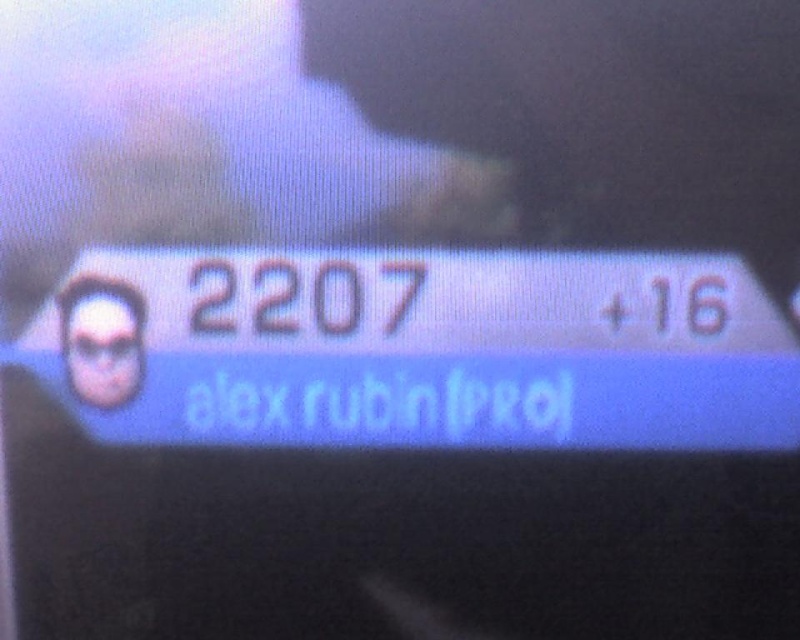
Question: Can you confirm if blue glossy text at center is bigger than matte black sunglasses at left?

Choices:
 (A) no
 (B) yes

Answer: (B)

Question: Which of the following is the closest to the observer?

Choices:
 (A) matte black sunglasses at left
 (B) blue glossy text at center

Answer: (B)

Question: Can you confirm if blue glossy text at center is positioned to the right of matte black sunglasses at left?

Choices:
 (A) yes
 (B) no

Answer: (A)

Question: Is blue glossy text at center wider than matte black sunglasses at left?

Choices:
 (A) yes
 (B) no

Answer: (A)